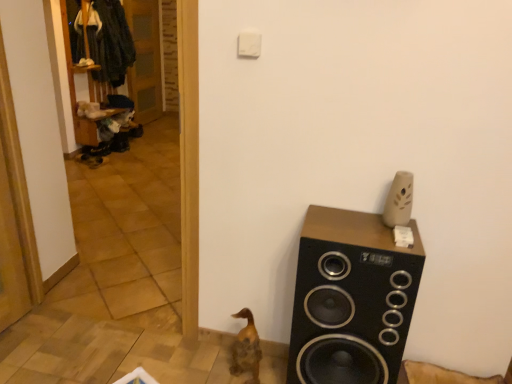
Question: Can you confirm if wooden at left is shorter than black matte speaker at right?

Choices:
 (A) no
 (B) yes

Answer: (A)

Question: From the image's perspective, is wooden at left beneath black matte speaker at right?

Choices:
 (A) no
 (B) yes

Answer: (A)

Question: Can you see wooden at left touching black matte speaker at right?

Choices:
 (A) no
 (B) yes

Answer: (A)

Question: Is wooden at left surrounding black matte speaker at right?

Choices:
 (A) no
 (B) yes

Answer: (A)

Question: Is wooden at left completely or partially outside of black matte speaker at right?

Choices:
 (A) no
 (B) yes

Answer: (B)

Question: Considering the relative sizes of wooden at left and black matte speaker at right in the image provided, is wooden at left wider than black matte speaker at right?

Choices:
 (A) yes
 (B) no

Answer: (B)

Question: Is wooden at left facing towards brown wooden duck at lower center?

Choices:
 (A) yes
 (B) no

Answer: (B)

Question: Does wooden at left have a smaller size compared to brown wooden duck at lower center?

Choices:
 (A) no
 (B) yes

Answer: (A)

Question: Is wooden at left next to brown wooden duck at lower center and touching it?

Choices:
 (A) yes
 (B) no

Answer: (B)

Question: Is wooden at left not close to brown wooden duck at lower center?

Choices:
 (A) no
 (B) yes

Answer: (B)

Question: Does wooden at left appear on the left side of brown wooden duck at lower center?

Choices:
 (A) yes
 (B) no

Answer: (A)

Question: Is wooden at left outside brown wooden duck at lower center?

Choices:
 (A) yes
 (B) no

Answer: (A)

Question: From the image's perspective, is black matte speaker at right over brown wooden duck at lower center?

Choices:
 (A) yes
 (B) no

Answer: (A)